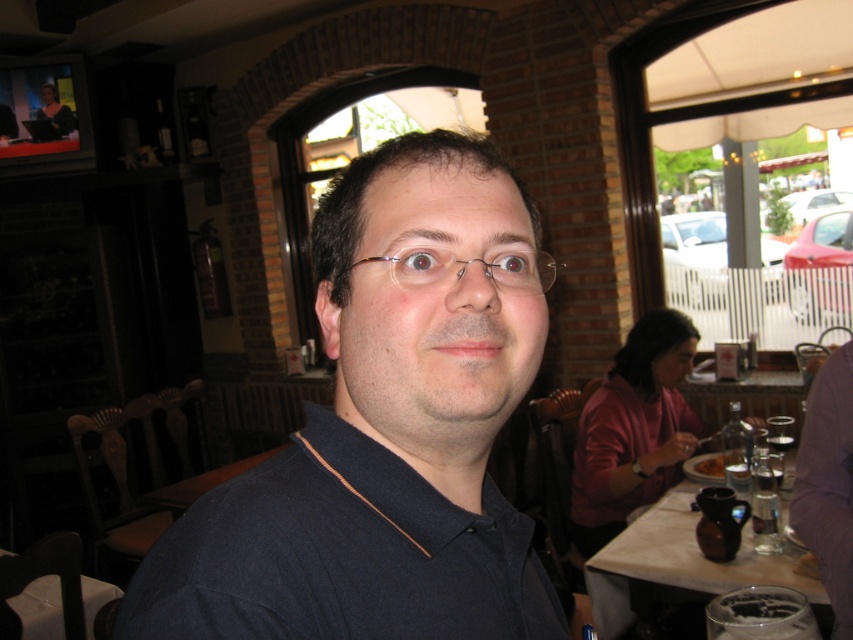
You are a photographer setting up for a photoshoot in this restaurant. You need to ensure that the dark blue cotton polo shirt at center and the transparent glass wine glass at right are both visible in the frame. Given their sizes, which object might require you to adjust your camera angle to ensure it doesn not get lost in the composition?

The dark blue cotton polo shirt at center has a smaller size compared to the transparent glass wine glass at right, so it might require adjusting the camera angle to ensure it stands out in the composition.

You are a photographer standing at the point marked as point (x=444, y=570). You want to take a photo of the man in the foreground and ensure both he and the arched doorway in the background are in focus. What is the minimum distance you should set your camera focus to achieve this?

The minimum distance you should set your camera focus to is half the distance between the man and the point (x=444, y=570), which would be 9.35 inches. This ensures both the man and the arched doorway are within the depth of field.

Consider the image. You are a photographer setting up for a photoshoot in this restaurant. You need to ensure that the dark blue cotton polo shirt at center and the white glossy table at lower left are both visible in the frame. Given their sizes, which object might require you to adjust your camera angle to include it properly?

The dark blue cotton polo shirt at center has a smaller size compared to the white glossy table at lower left, so you might need to adjust the camera angle to ensure the smaller polo shirt is adequately captured in the frame.